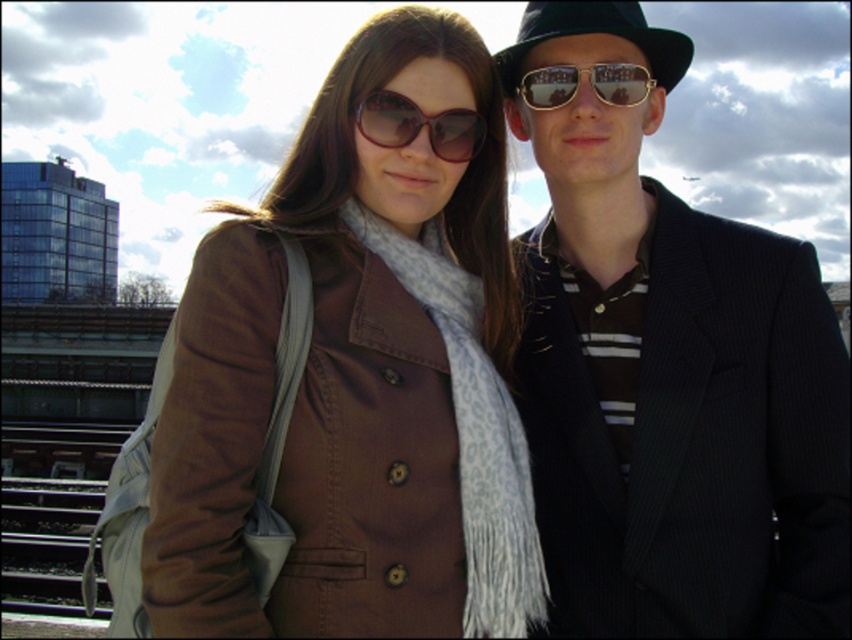
You are taking a photo of the shiny black suit at center and the sunglasses at center. Which object should you focus on first if you want to ensure both are in focus?

The shiny black suit at center is taller than sunglasses at center, so you should focus on the shiny black suit at center first to ensure both are in focus.